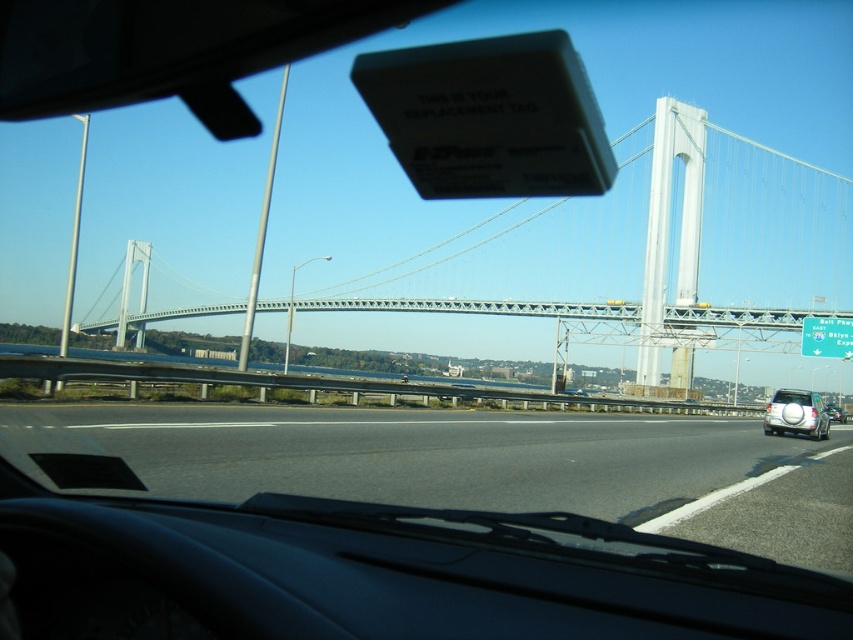
Question: Does white metallic suspension bridge at center have a lesser width compared to white matte suv at right?

Choices:
 (A) no
 (B) yes

Answer: (A)

Question: Based on their relative distances, which object is farther from the white metallic suspension bridge at center?

Choices:
 (A) white matte suv at right
 (B) black asphalt highway at center

Answer: (A)

Question: Based on their relative distances, which object is nearer to the white matte suv at right?

Choices:
 (A) black asphalt highway at center
 (B) white metallic suspension bridge at center

Answer: (A)

Question: Observing the image, what is the correct spatial positioning of black asphalt highway at center in reference to white matte suv at right?

Choices:
 (A) left
 (B) right

Answer: (A)

Question: Among these objects, which one is farthest from the camera?

Choices:
 (A) white metallic suspension bridge at center
 (B) white matte suv at right

Answer: (B)

Question: In this image, where is white metallic suspension bridge at center located relative to white matte suv at right?

Choices:
 (A) above
 (B) below

Answer: (A)